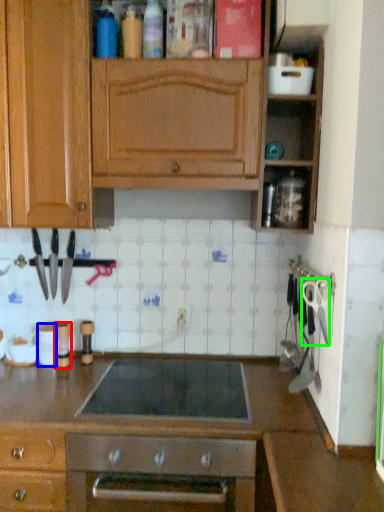
Question: Estimate the real-world distances between objects in this image. Which object is closer to appliance (highlighted by a red box), appliance (highlighted by a blue box) or scissors (highlighted by a green box)?

Choices:
 (A) appliance
 (B) scissors

Answer: (A)